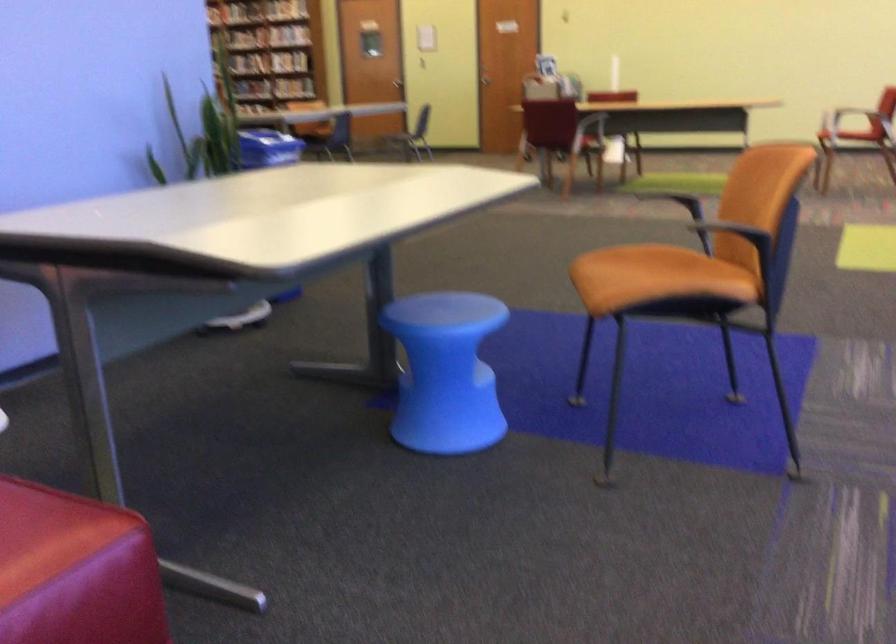
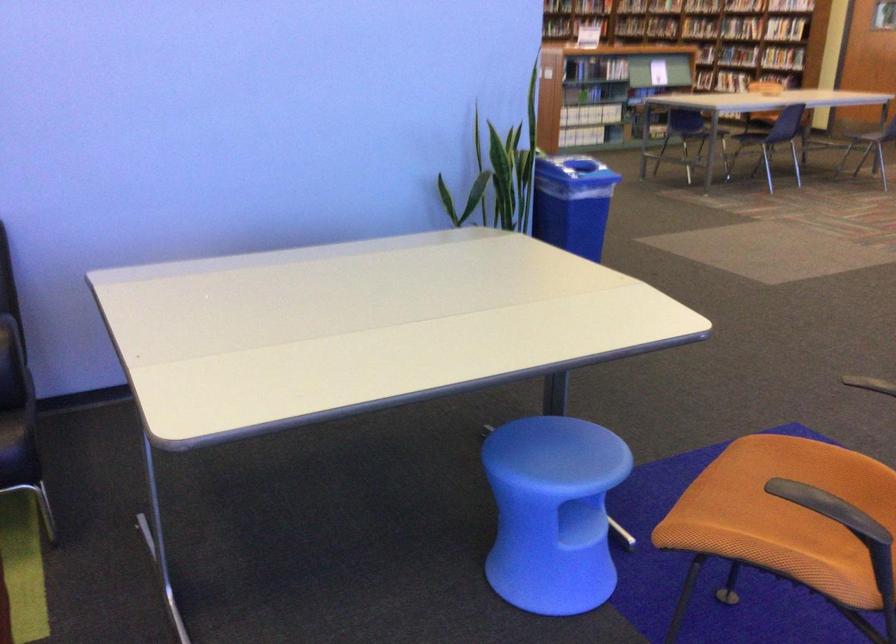
The point at (449, 313) is marked in the first image. Where is the corresponding point in the second image?

(560, 453)